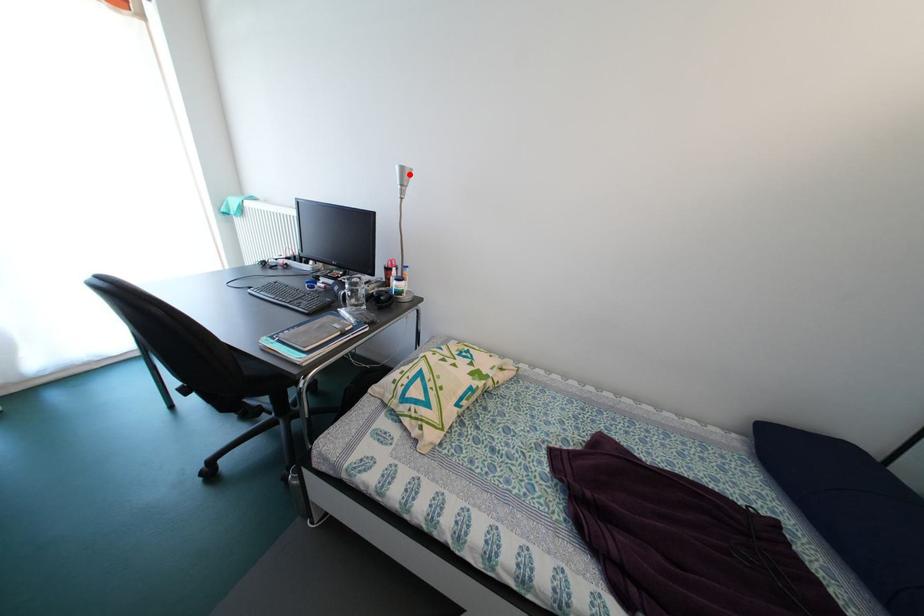
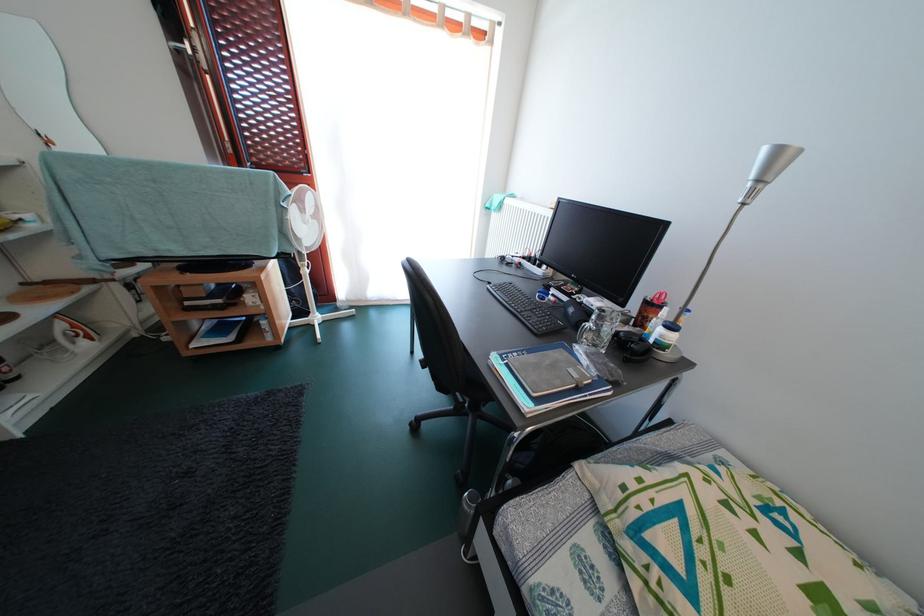
Locate, in the second image, the point that corresponds to the highlighted location in the first image.

(785, 156)